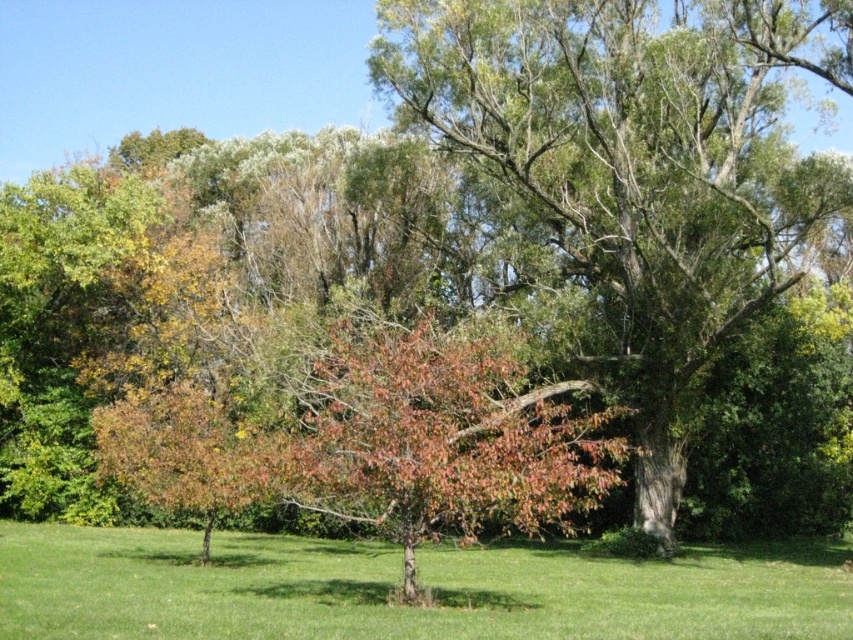
Question: Which point is farther to the camera?

Choices:
 (A) green leafy tree at center
 (B) green grass at center

Answer: (A)

Question: From the image, what is the correct spatial relationship of green leafy tree at center in relation to green grass at center?

Choices:
 (A) above
 (B) below

Answer: (A)

Question: Which of the following is the farthest from the observer?

Choices:
 (A) green leafy tree at center
 (B) green grass at center

Answer: (A)

Question: Considering the relative positions of green leafy tree at center and green grass at center in the image provided, where is green leafy tree at center located with respect to green grass at center?

Choices:
 (A) left
 (B) right

Answer: (B)

Question: Which object appears farthest from the camera in this image?

Choices:
 (A) green leafy tree at center
 (B) green grass at center

Answer: (A)

Question: Considering the relative positions of green leafy tree at center and green grass at center in the image provided, where is green leafy tree at center located with respect to green grass at center?

Choices:
 (A) above
 (B) below

Answer: (A)